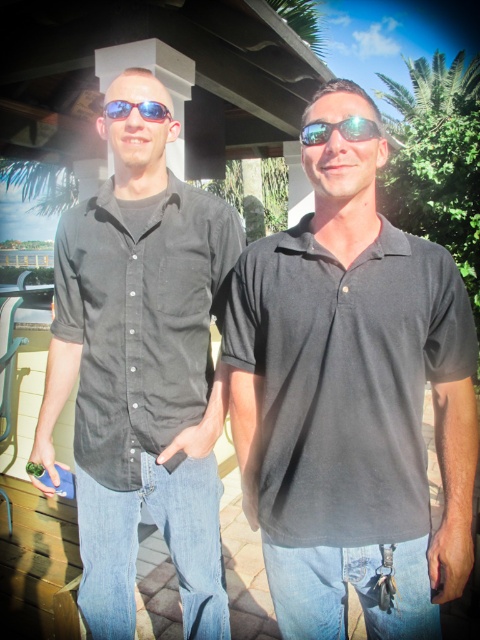
Question: Which point is farther to the camera?

Choices:
 (A) [382, 134]
 (B) [141, 104]

Answer: (B)

Question: Is black cotton polo shirt at center smaller than matte black sunglasses at upper center?

Choices:
 (A) no
 (B) yes

Answer: (A)

Question: Is black cotton polo shirt at center to the right of matte black shirt at left from the viewer's perspective?

Choices:
 (A) no
 (B) yes

Answer: (B)

Question: Does black cotton polo shirt at center have a lesser width compared to matte black sunglasses at upper center?

Choices:
 (A) no
 (B) yes

Answer: (A)

Question: Which object appears closest to the camera in this image?

Choices:
 (A) black cotton polo shirt at center
 (B) sunglasses at center
 (C) matte black shirt at left

Answer: (A)

Question: Which point is closer to the camera taking this photo?

Choices:
 (A) (309, 520)
 (B) (354, 124)
 (C) (162, 108)
 (D) (108, 122)

Answer: (B)